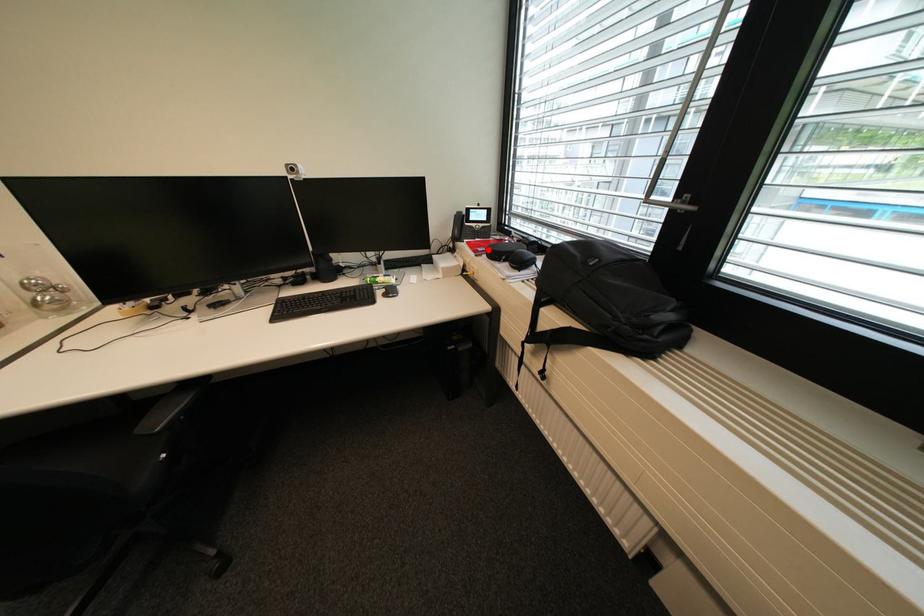
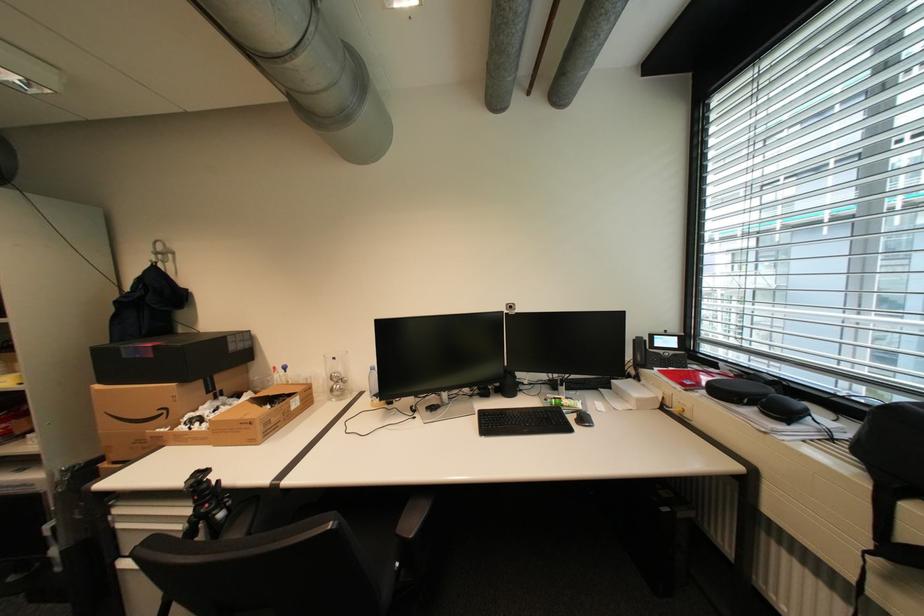
Locate, in the second image, the point that corresponds to the highlighted location in the first image.

(695, 383)